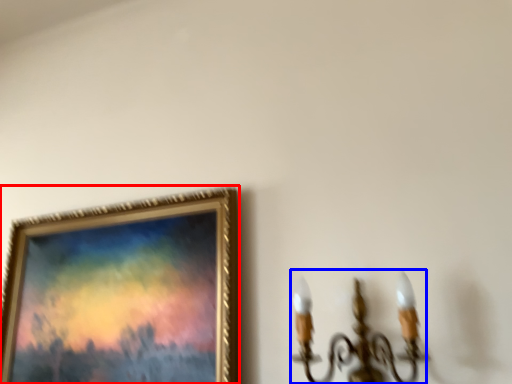
Question: Which of the following is the farthest to the observer, picture frame (highlighted by a red box) or lamp (highlighted by a blue box)?

Choices:
 (A) picture frame
 (B) lamp

Answer: (A)